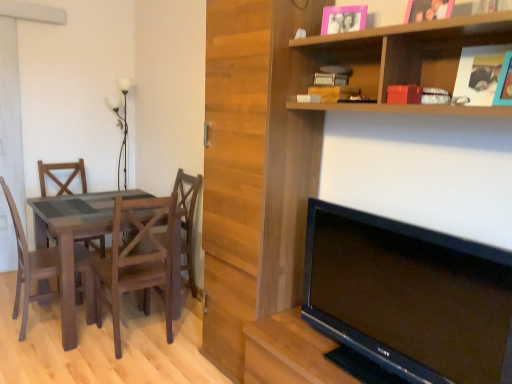
Question: Does white glass lamp at upper left have a smaller size compared to wooden chair at center, the first chair positioned from the right?

Choices:
 (A) yes
 (B) no

Answer: (A)

Question: Is white glass lamp at upper left taller than wooden chair at center, placed as the 3th chair when sorted from left to right?

Choices:
 (A) no
 (B) yes

Answer: (B)

Question: Does white glass lamp at upper left turn towards wooden chair at center, the first chair positioned from the right?

Choices:
 (A) yes
 (B) no

Answer: (A)

Question: Considering the relative positions of white glass lamp at upper left and wooden chair at center, placed as the 3th chair when sorted from left to right, in the image provided, is white glass lamp at upper left to the right of wooden chair at center, placed as the 3th chair when sorted from left to right, from the viewer's perspective?

Choices:
 (A) no
 (B) yes

Answer: (A)

Question: Is white glass lamp at upper left further to camera compared to wooden chair at center, the first chair positioned from the right?

Choices:
 (A) yes
 (B) no

Answer: (A)

Question: From the image's perspective, is white glass lamp at upper left on wooden chair at center, placed as the 3th chair when sorted from left to right?

Choices:
 (A) yes
 (B) no

Answer: (A)

Question: Is pink matte picture frame at upper center, the first picture frame in the front-to-back sequence, aimed at matte wood table at left?

Choices:
 (A) no
 (B) yes

Answer: (A)

Question: Are pink matte picture frame at upper center, arranged as the 1th picture frame when viewed from the right, and matte wood table at left beside each other?

Choices:
 (A) yes
 (B) no

Answer: (B)

Question: Is pink matte picture frame at upper center, the first picture frame in the front-to-back sequence, not close to matte wood table at left?

Choices:
 (A) no
 (B) yes

Answer: (B)

Question: Does pink matte picture frame at upper center, which is counted as the second picture frame, starting from the left, have a smaller size compared to matte wood table at left?

Choices:
 (A) yes
 (B) no

Answer: (A)

Question: Would you say matte wood table at left is part of pink matte picture frame at upper center, which is counted as the 2th picture frame, starting from the back,'s contents?

Choices:
 (A) yes
 (B) no

Answer: (B)

Question: Is pink matte picture frame at upper center, arranged as the 1th picture frame when viewed from the right, taller than matte wood table at left?

Choices:
 (A) no
 (B) yes

Answer: (A)

Question: Does wooden textured chair at left, acting as the second chair starting from the left, appear on the right side of wooden shelf at upper right?

Choices:
 (A) no
 (B) yes

Answer: (A)